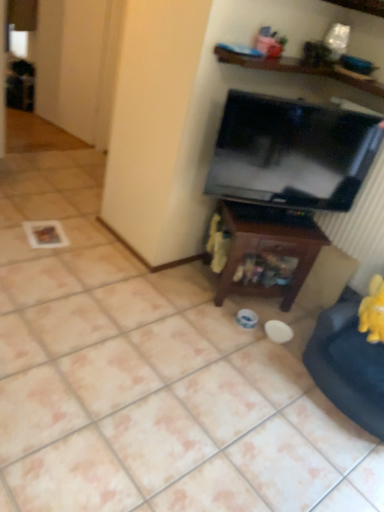
Question: Can you confirm if wooden at upper center is smaller than brown wood table at center?

Choices:
 (A) yes
 (B) no

Answer: (A)

Question: Is wooden at upper center wider than brown wood table at center?

Choices:
 (A) yes
 (B) no

Answer: (A)

Question: Is wooden at upper center taller than brown wood table at center?

Choices:
 (A) yes
 (B) no

Answer: (B)

Question: Can you confirm if wooden at upper center is shorter than brown wood table at center?

Choices:
 (A) no
 (B) yes

Answer: (B)

Question: Does wooden at upper center turn towards brown wood table at center?

Choices:
 (A) yes
 (B) no

Answer: (B)

Question: Is wooden at upper center closer to camera compared to brown wood table at center?

Choices:
 (A) yes
 (B) no

Answer: (A)

Question: From a real-world perspective, is black glossy tv at upper right located higher than velvet yellow swivel chair at lower right?

Choices:
 (A) no
 (B) yes

Answer: (B)

Question: From the image's perspective, is black glossy tv at upper right above velvet yellow swivel chair at lower right?

Choices:
 (A) yes
 (B) no

Answer: (A)

Question: Is velvet yellow swivel chair at lower right at the back of black glossy tv at upper right?

Choices:
 (A) yes
 (B) no

Answer: (B)

Question: Is black glossy tv at upper right far away from velvet yellow swivel chair at lower right?

Choices:
 (A) no
 (B) yes

Answer: (A)

Question: Can you confirm if black glossy tv at upper right is taller than velvet yellow swivel chair at lower right?

Choices:
 (A) yes
 (B) no

Answer: (A)

Question: Can you confirm if black glossy tv at upper right is smaller than velvet yellow swivel chair at lower right?

Choices:
 (A) yes
 (B) no

Answer: (A)

Question: Does velvet yellow swivel chair at lower right touch black glossy tv at upper right?

Choices:
 (A) yes
 (B) no

Answer: (B)